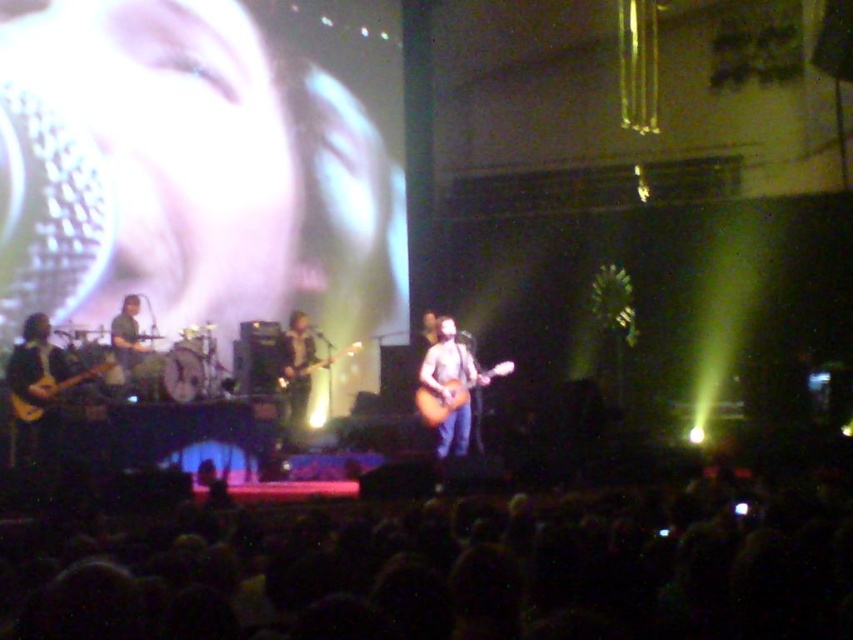
At what (x,y) coordinates should I click in order to perform the action: click on light brown wood electric guitar at left. Please return your answer as a coordinate pair (x, y). Looking at the image, I should click on (73, 378).

Based on the photo, is light brown wood electric guitar at left bigger than wooden acoustic guitar at center?

Yes.

What do you see at coordinates (73, 378) in the screenshot?
I see `light brown wood electric guitar at left` at bounding box center [73, 378].

Locate an element on the screen. light brown wood electric guitar at left is located at coordinates click(73, 378).

Can you confirm if black hair at lower center is smaller than acoustic wood guitar at center?

No.

Between black hair at lower center and acoustic wood guitar at center, which one is positioned higher?

Positioned higher is acoustic wood guitar at center.

Who is more distant from viewer, (402, 532) or (463, 396)?

The point (463, 396) is behind.

Locate an element on the screen. This screenshot has height=640, width=853. black hair at lower center is located at coordinates (431, 563).

Which of these two, acoustic wood guitar at center or light brown wood electric guitar at left, stands taller?

acoustic wood guitar at center

This screenshot has width=853, height=640. I want to click on acoustic wood guitar at center, so click(438, 401).